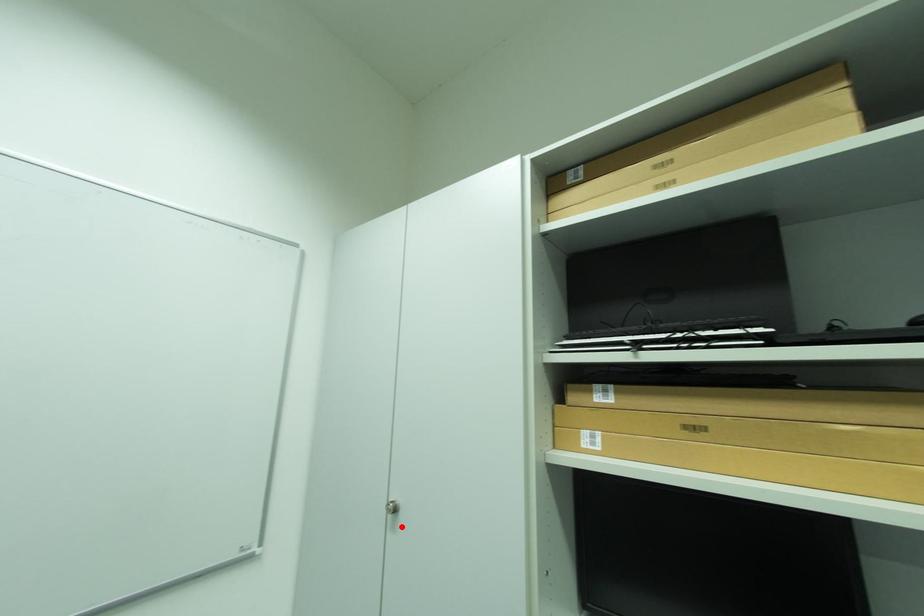
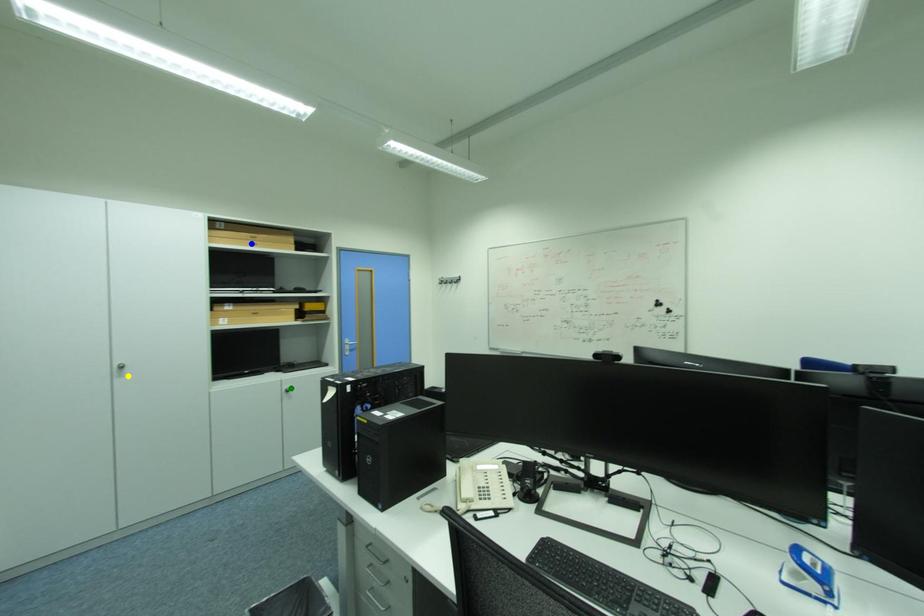
Question: I am providing you with two images of the same scene from different viewpoints. A red point is marked on the first image. You are given multiple points on the second image. Can you choose the point in image 2 that corresponds to the point in image 1?

Choices:
 (A) yellow point
 (B) blue point
 (C) green point

Answer: (A)